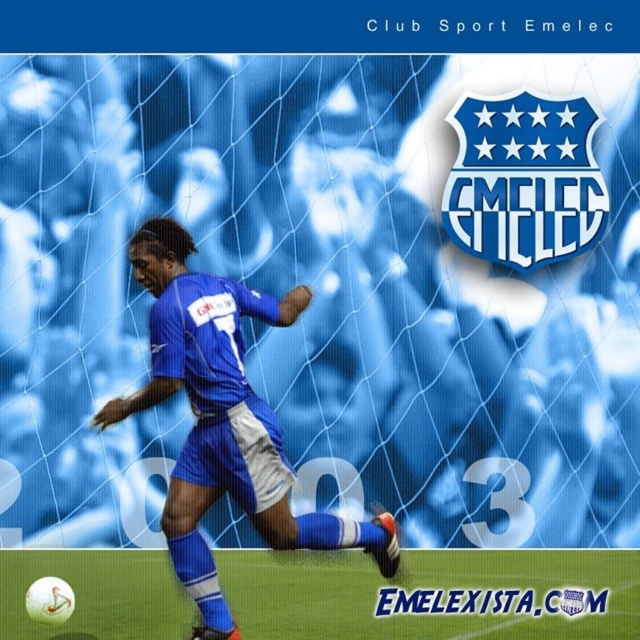
You are a photographer trying to capture the soccer player in the image. Since the green grass at center and the blue fabric soccer player at center are both in the frame, which one appears smaller in the photo?

The green grass at center appears smaller in the photo because it has a smaller size compared to the blue fabric soccer player at center.